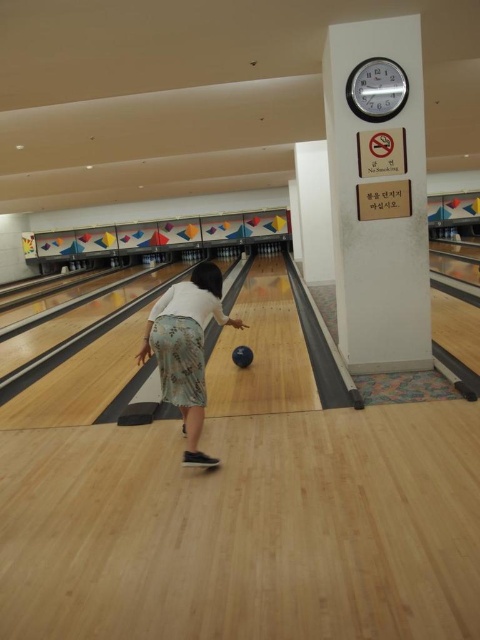
Between point (144, 353) and point (252, 356), which one is positioned behind?

Point (252, 356)

Does point (217, 284) come in front of point (240, 362)?

Yes, it is.

At what (x,y) coordinates should I click in order to perform the action: click on floral skirt at center. Please return your answer as a coordinate pair (x, y). Looking at the image, I should click on point(186,348).